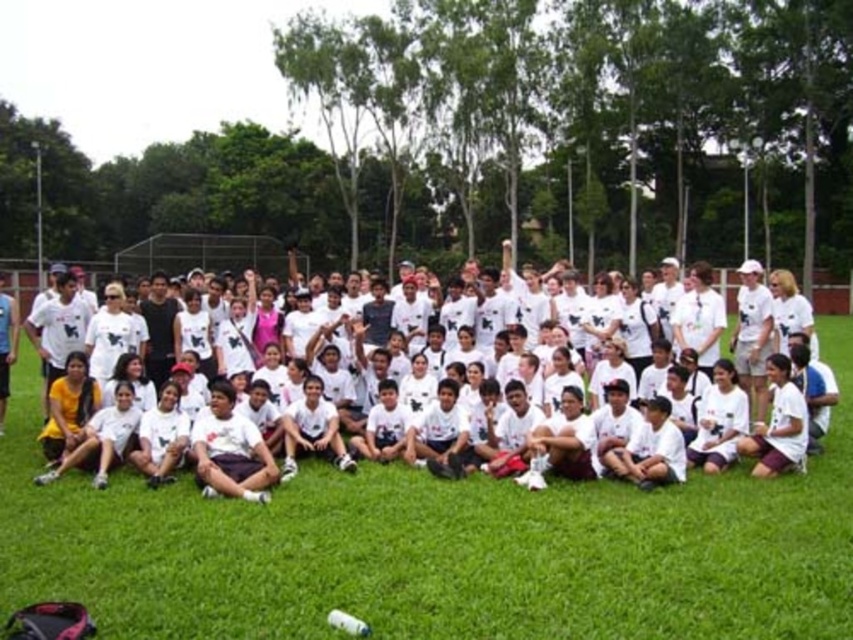
You are taking a photo of the group and want to ensure the green grass at center is positioned exactly at the center of the frame. Given its current coordinates, should you move the camera upwards or downwards?

The green grass at center is located at coordinates approximately 0.859 on the vertical axis. Since the center of the frame is at 0.5, moving the camera upwards would decrease the vertical coordinate, bringing it closer to the desired center position.

You are standing at the center of the grassy field where the group photo is being taken. You notice two specific points marked in the scene. The first point is at coordinates point (491, 570) and the second is at point (53, 348). Which of these two points is closer to you?

Point (491, 570) is in front of point (53, 348), so it is closer to you.